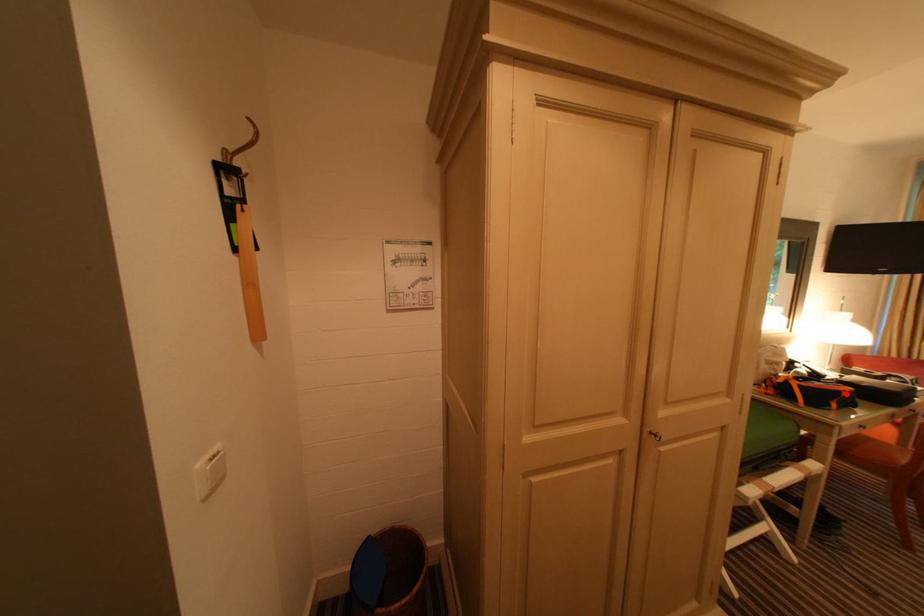
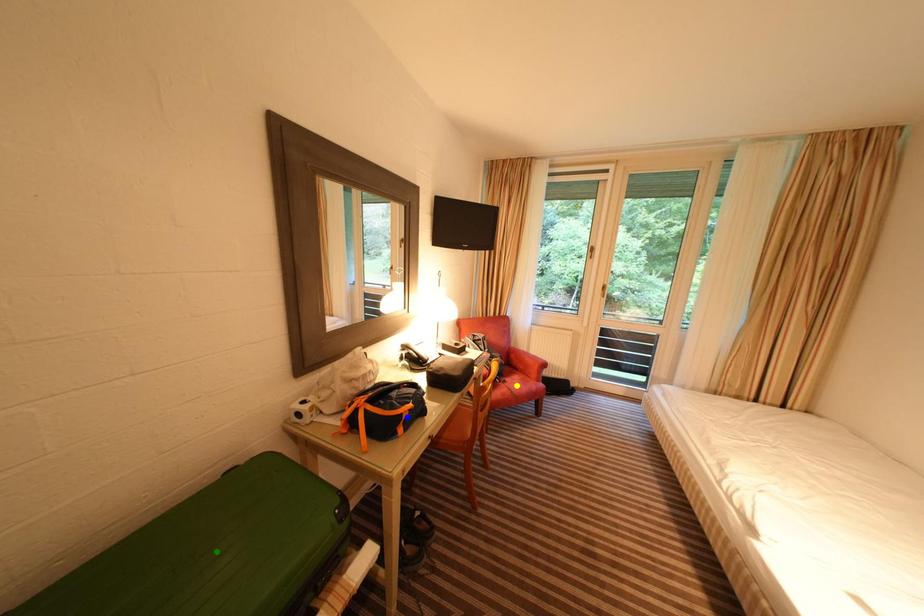
Question: I am providing you with two images of the same scene from different viewpoints. A red point is marked on the first image. You are given multiple points on the second image. Can you choose the point in image 2 that corresponds to the point in image 1?

Choices:
 (A) yellow point
 (B) blue point
 (C) green point

Answer: (B)